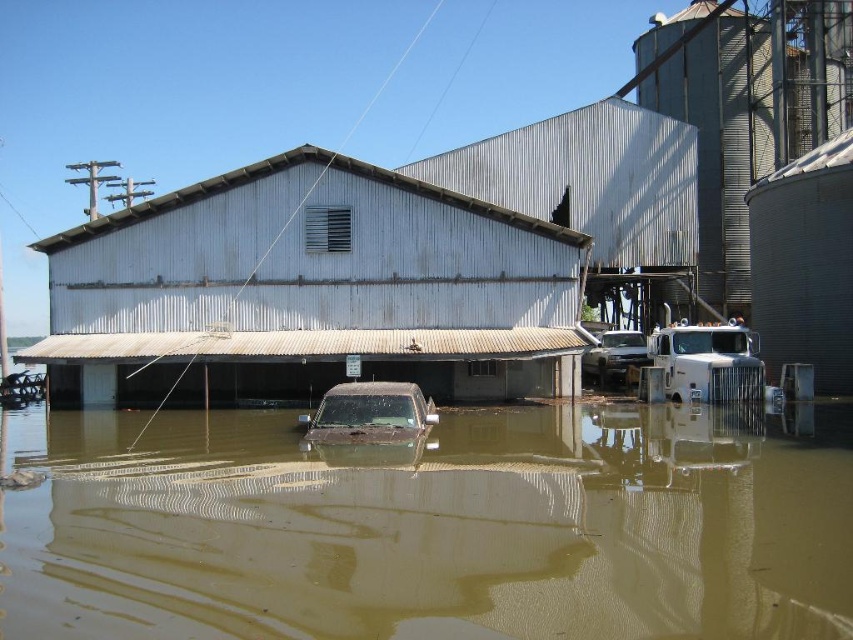
You are standing at the edge of the flooded area and see two points marked in the image. Which point, point [158,625] or point [776,234], is closer to you?

Point [158,625] is closer to the viewer than point [776,234].

You are a delivery driver trying to navigate through the flooded area. You see a brushed metal silo at upper right and a dirty matte truck at center. Which object is higher in elevation compared to the other?

The brushed metal silo at upper right is above the dirty matte truck at center, so it has a higher elevation.

You are a rescue worker trying to reach the flooded area. You see the brushed metal silo at upper right and the muddy brown truck at center. Which object is closer to you?

The brushed metal sillo at upper right is closer to you because it is further to the viewer than the muddy brown truck at center.